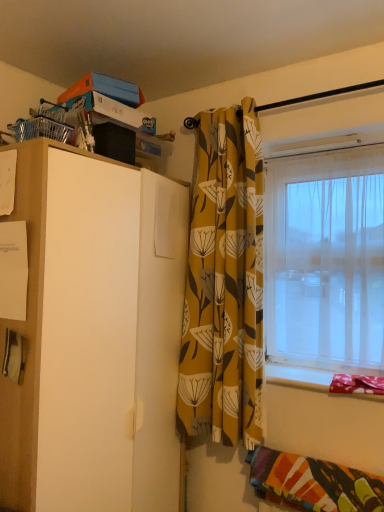
Question: Is transparent plastic window at right beside white matte cabinet at left?

Choices:
 (A) yes
 (B) no

Answer: (B)

Question: Considering the relative positions of transparent plastic window at right and white matte cabinet at left in the image provided, is transparent plastic window at right to the right of white matte cabinet at left from the viewer's perspective?

Choices:
 (A) no
 (B) yes

Answer: (B)

Question: Is transparent plastic window at right shorter than white matte cabinet at left?

Choices:
 (A) no
 (B) yes

Answer: (B)

Question: Is the position of transparent plastic window at right less distant than that of white matte cabinet at left?

Choices:
 (A) no
 (B) yes

Answer: (A)

Question: Considering the relative sizes of transparent plastic window at right and white matte cabinet at left in the image provided, is transparent plastic window at right smaller than white matte cabinet at left?

Choices:
 (A) no
 (B) yes

Answer: (B)

Question: From a real-world perspective, is white matte cabinet at left above or below fabric covered window sill at lower right?

Choices:
 (A) below
 (B) above

Answer: (B)

Question: Is white matte cabinet at left bigger or smaller than fabric covered window sill at lower right?

Choices:
 (A) small
 (B) big

Answer: (B)

Question: In the image, is white matte cabinet at left on the left side or the right side of fabric covered window sill at lower right?

Choices:
 (A) left
 (B) right

Answer: (A)

Question: Do you think white matte cabinet at left is within fabric covered window sill at lower right, or outside of it?

Choices:
 (A) inside
 (B) outside

Answer: (B)

Question: Is fabric covered window sill at lower right in front of or behind multicolored woven blanket at lower right in the image?

Choices:
 (A) front
 (B) behind

Answer: (B)

Question: From a real-world perspective, is fabric covered window sill at lower right physically located above or below multicolored woven blanket at lower right?

Choices:
 (A) above
 (B) below

Answer: (A)

Question: Based on their positions, is fabric covered window sill at lower right located to the left or right of multicolored woven blanket at lower right?

Choices:
 (A) right
 (B) left

Answer: (A)

Question: From the image's perspective, is fabric covered window sill at lower right located above or below multicolored woven blanket at lower right?

Choices:
 (A) above
 (B) below

Answer: (A)

Question: From a real-world perspective, is multicolored woven blanket at lower right above or below white matte cabinet at left?

Choices:
 (A) below
 (B) above

Answer: (A)

Question: Is multicolored woven blanket at lower right to the left or to the right of white matte cabinet at left in the image?

Choices:
 (A) left
 (B) right

Answer: (B)